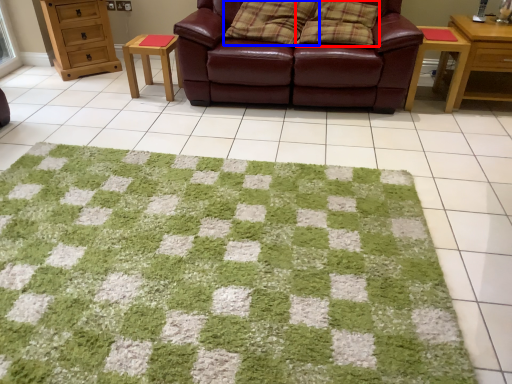
Question: Which object is closer to the camera taking this photo, pillow (highlighted by a red box) or pillow (highlighted by a blue box)?

Choices:
 (A) pillow
 (B) pillow

Answer: (A)